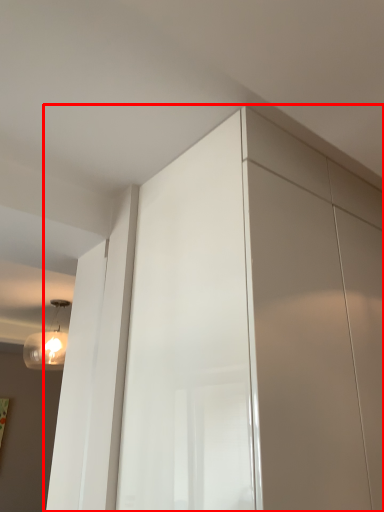
Question: Considering the relative positions of dresser (annotated by the red box) and light fixture in the image provided, where is dresser (annotated by the red box) located with respect to the staircase?

Choices:
 (A) left
 (B) right

Answer: (B)